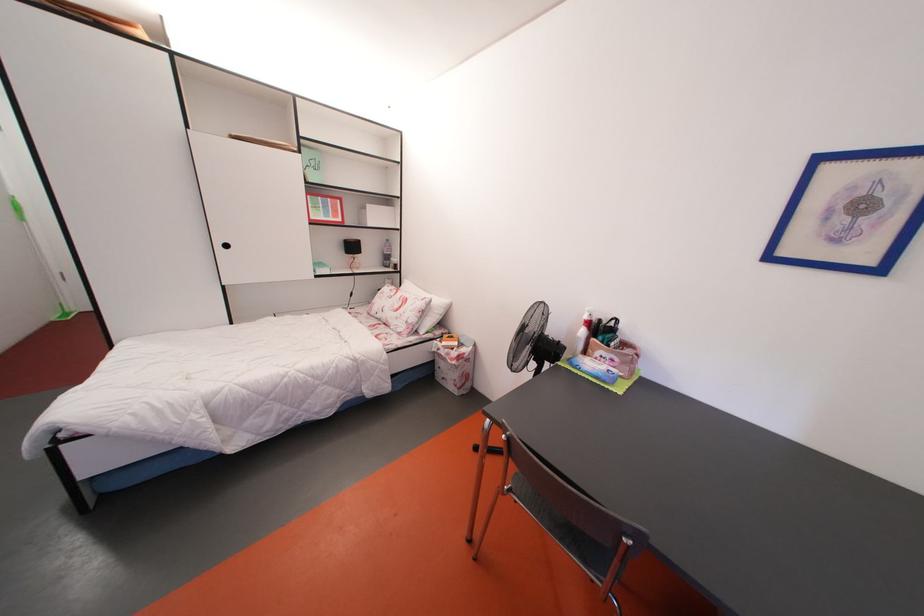
Describe the element at coordinates (455, 363) in the screenshot. The image size is (924, 616). I see `the pink fabric pouch` at that location.